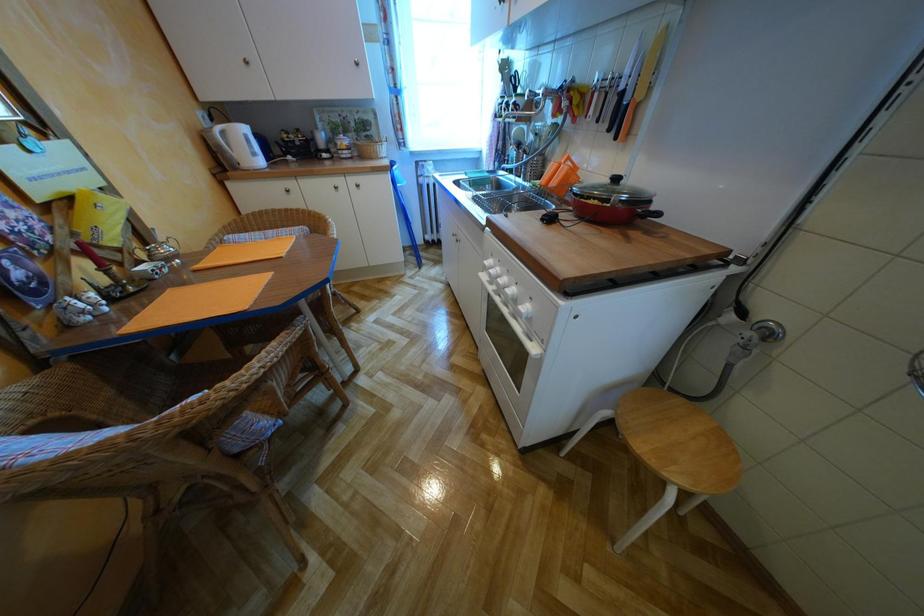
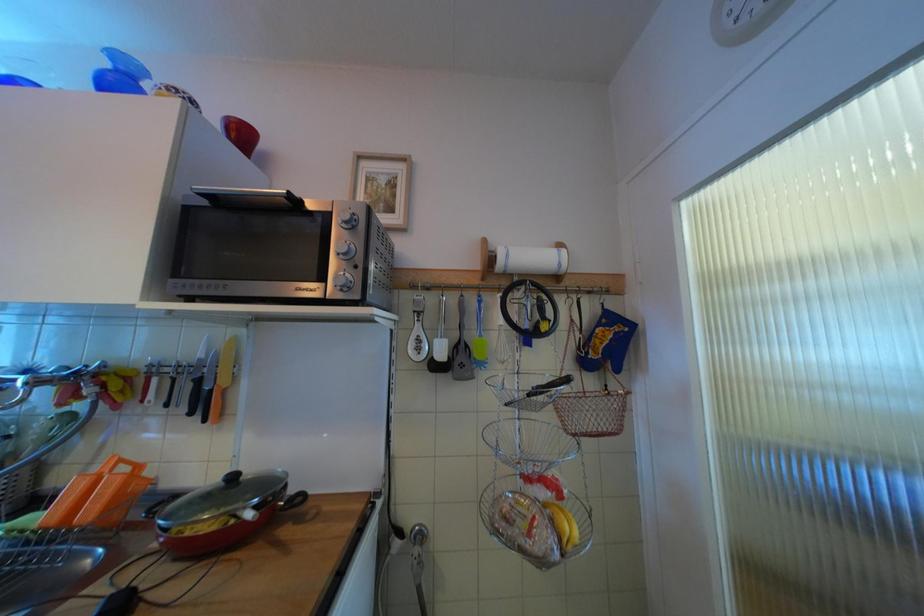
Question: The images are taken continuously from a first-person perspective. In which direction is your viewpoint rotating?

Choices:
 (A) Left
 (B) Right
 (C) Up
 (D) Down

Answer: (B)